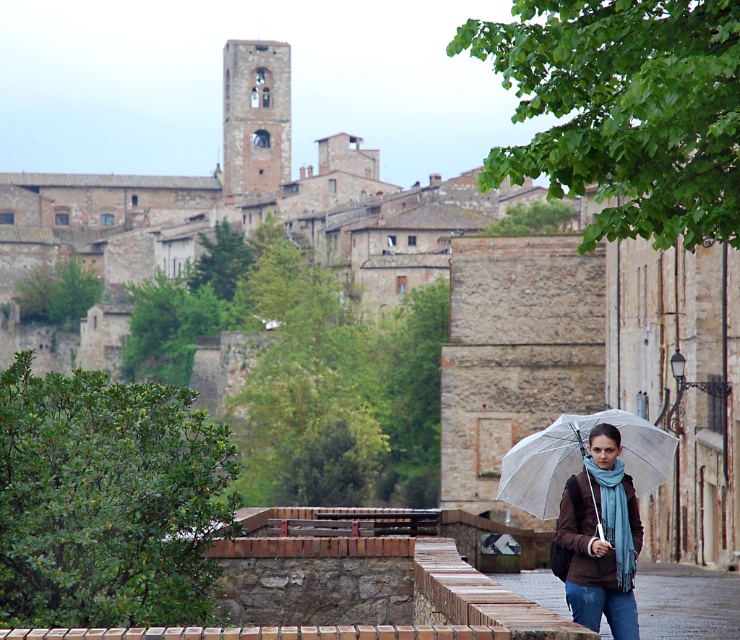
Question: Does brown matte jacket at lower right have a greater width compared to smooth stone alley at lower center?

Choices:
 (A) no
 (B) yes

Answer: (A)

Question: Is transparent plastic umbrella at center smaller than smooth stone alley at lower center?

Choices:
 (A) no
 (B) yes

Answer: (B)

Question: Which point is farther to the camera?

Choices:
 (A) tap(519, 452)
 (B) tap(726, 602)

Answer: (B)

Question: Which point is closer to the camera?

Choices:
 (A) (615, 451)
 (B) (505, 493)
 (C) (645, 634)

Answer: (A)

Question: Which of the following is the farthest from the observer?

Choices:
 (A) (556, 470)
 (B) (588, 513)

Answer: (A)

Question: Does brown matte jacket at lower right have a greater width compared to transparent plastic umbrella at center?

Choices:
 (A) yes
 (B) no

Answer: (B)